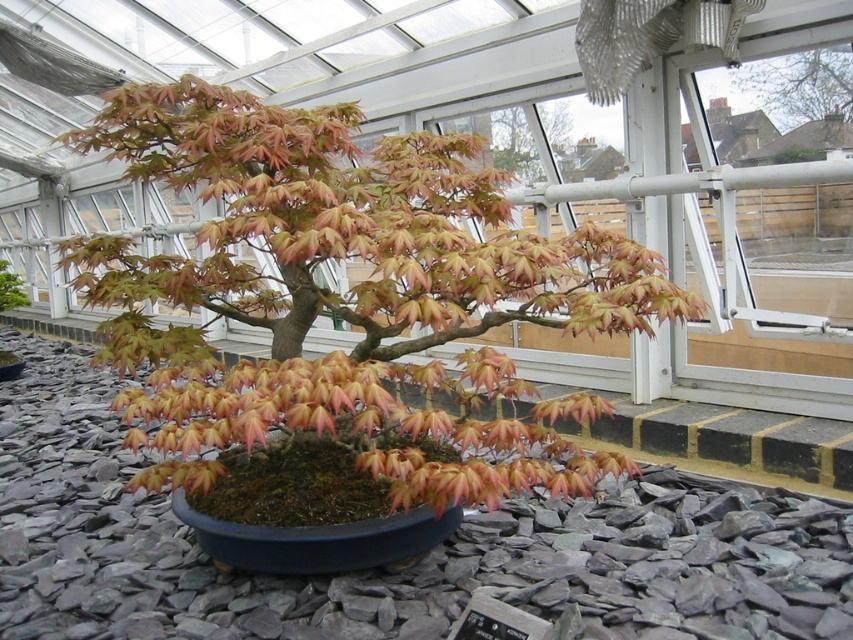
You are a gardener who wants to water the gray gravel at center without getting the matte orange maple at center wet. Is this possible given their positions?

The matte orange maple at center is located above the gray gravel at center, so watering the gravel directly beneath it would likely wet the maple as well. To avoid this, the gardener should use a watering method that targets the gravel without spraying upwards, such as a drip irrigation system placed beneath the maple.